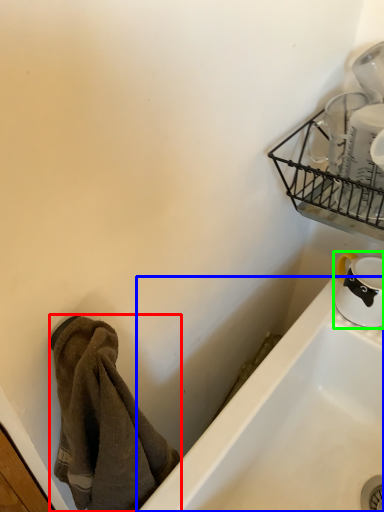
Question: Which is nearer to the towel/napkin (highlighted by a red box)? bathtub (highlighted by a blue box) or tableware (highlighted by a green box).

Choices:
 (A) bathtub
 (B) tableware

Answer: (A)